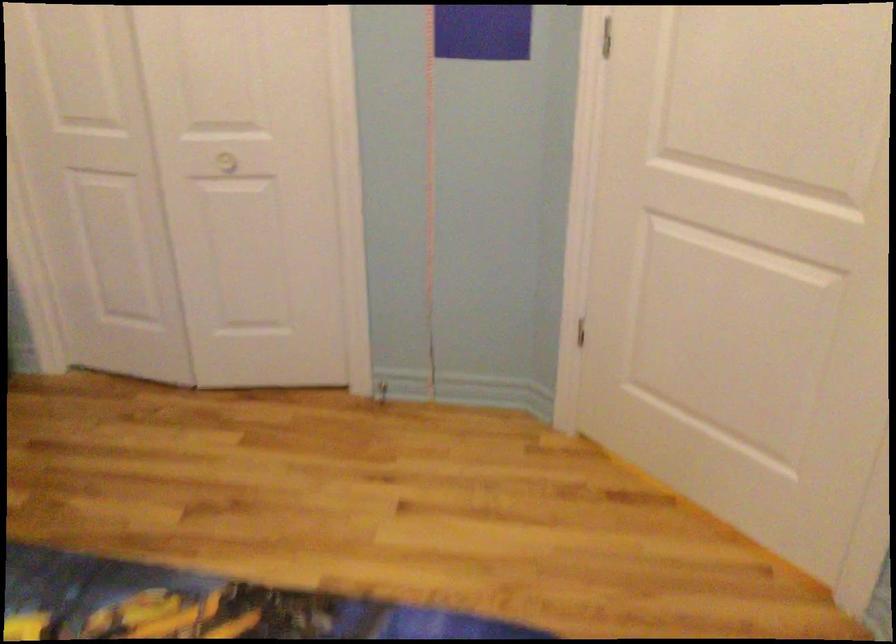
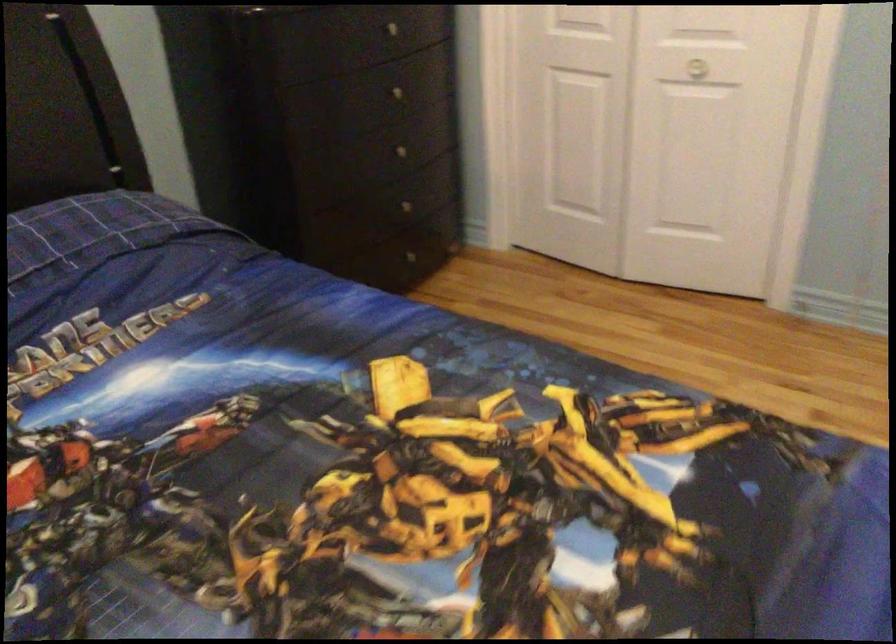
Question: Based on the continuous images, in which direction is the camera rotating? Reply with the corresponding letter.

Choices:
 (A) Left
 (B) Right
 (C) Up
 (D) Down

Answer: (A)